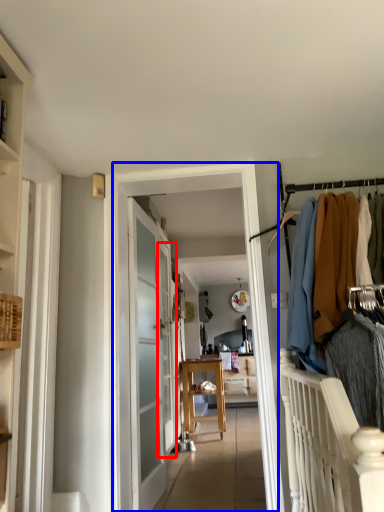
Question: Which object appears closest to the camera in this image, screen door (highlighted by a red box) or clothing store (highlighted by a blue box)?

Choices:
 (A) screen door
 (B) clothing store

Answer: (B)